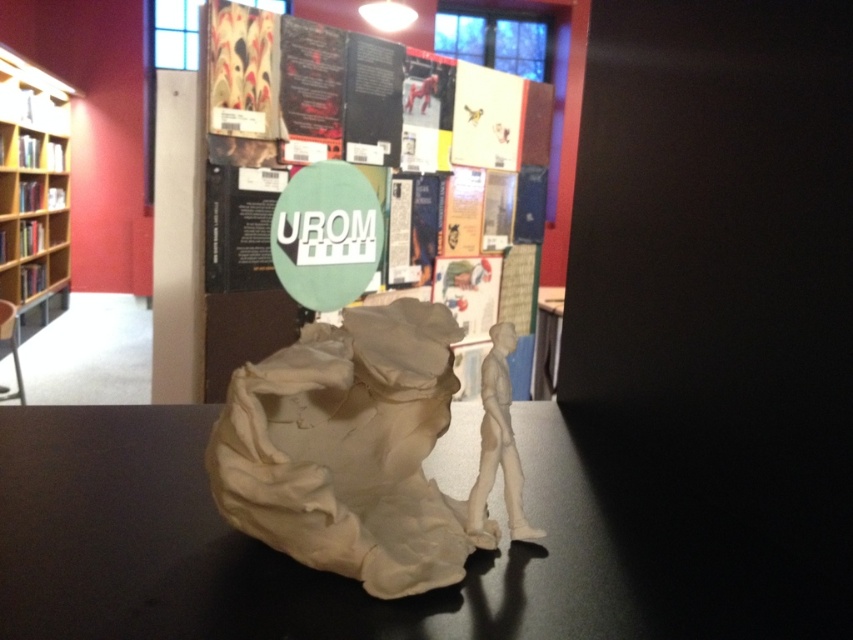
Does beige matte sculpture at center have a lesser width compared to matte beige sculpture at center?

Incorrect, beige matte sculpture at center's width is not less than matte beige sculpture at center's.

I want to click on beige matte sculpture at center, so click(283, 556).

Where is `beige matte sculpture at center`? beige matte sculpture at center is located at coordinates (283, 556).

Which is above, matte beige sculpture at center or wooden bookshelf at left?

wooden bookshelf at left

Can you confirm if matte beige sculpture at center is smaller than wooden bookshelf at left?

Correct, matte beige sculpture at center occupies less space than wooden bookshelf at left.

Find the location of a particular element. This screenshot has height=640, width=853. matte beige sculpture at center is located at coordinates (349, 451).

Can you confirm if beige matte sculpture at center is smaller than wooden bookshelf at left?

Yes.

Measure the distance between point (x=200, y=595) and camera.

A distance of 17.79 inches exists between point (x=200, y=595) and camera.

Is point (630, 628) positioned before point (57, 268)?

That is True.

You are a GUI agent. You are given a task and a screenshot of the screen. Output one action in this format:
    pyautogui.click(x=<x>, y=<y>)
    Task: Click on the beige matte sculpture at center
    Image resolution: width=853 pixels, height=640 pixels.
    Given the screenshot: What is the action you would take?
    pyautogui.click(x=283, y=556)